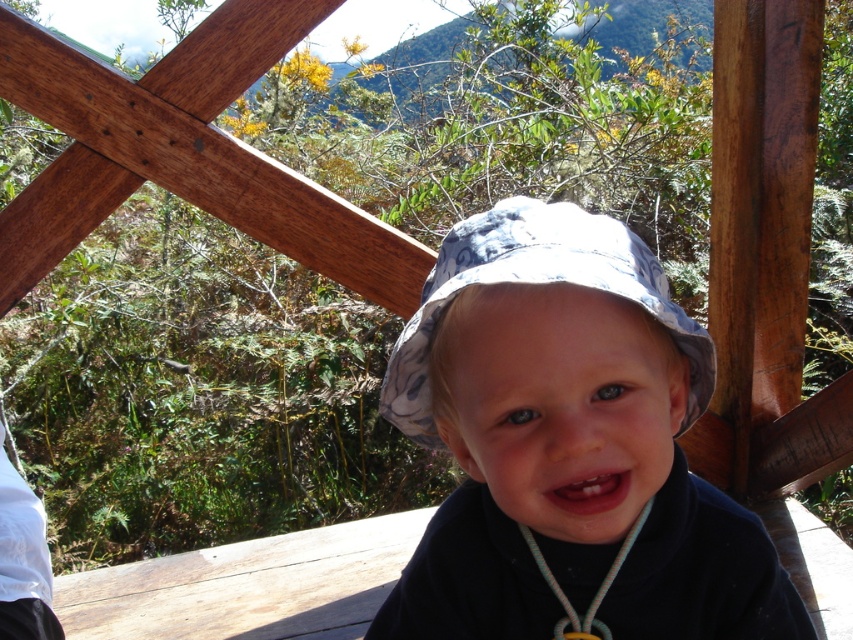
Question: Does blue floral fabric hat at center have a lesser width compared to rope-like necklace at center?

Choices:
 (A) no
 (B) yes

Answer: (A)

Question: Which point is farther to the camera?

Choices:
 (A) rope-like necklace at center
 (B) blue floral hat at center

Answer: (A)

Question: Can you confirm if blue floral hat at center is bigger than blue floral fabric hat at center?

Choices:
 (A) yes
 (B) no

Answer: (A)

Question: Which point appears farthest from the camera in this image?

Choices:
 (A) (573, 262)
 (B) (502, 548)
 (C) (630, 538)

Answer: (B)

Question: From the image, what is the correct spatial relationship of blue floral fabric hat at center in relation to rope-like necklace at center?

Choices:
 (A) left
 (B) right

Answer: (A)

Question: Which point is closer to the camera?

Choices:
 (A) blue floral fabric hat at center
 (B) rope-like necklace at center

Answer: (A)